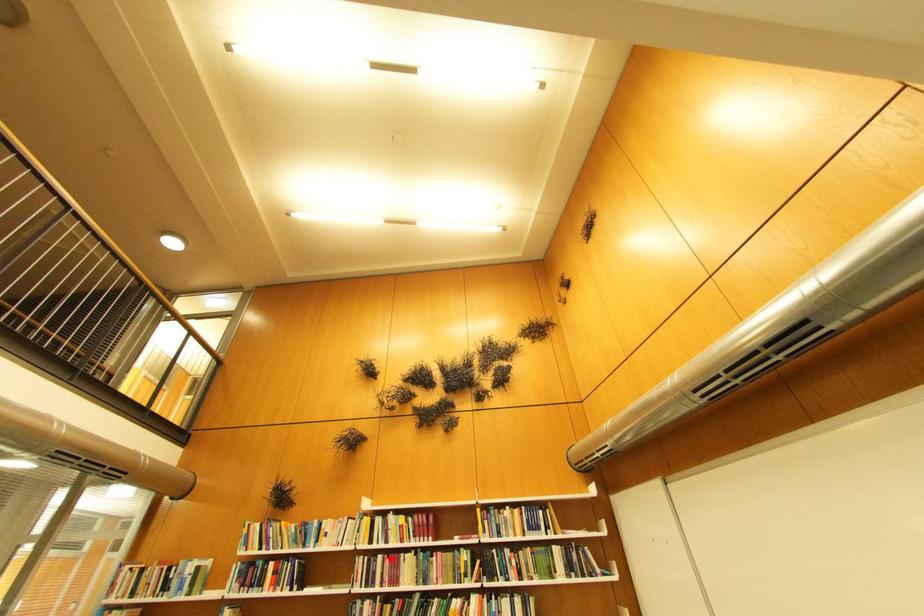
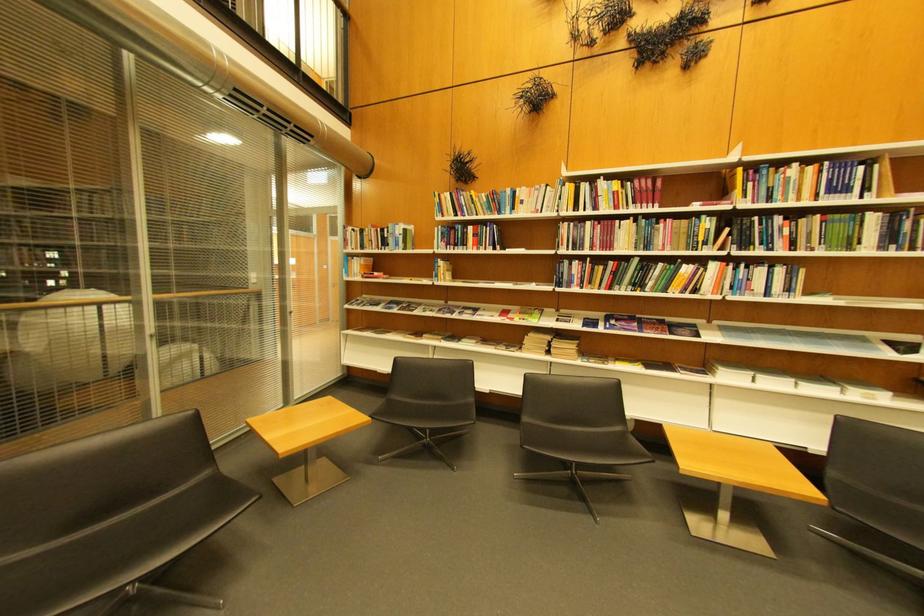
Question: I am providing you with two images of the same scene from different viewpoints. A red point is shown in image1. For the corresponding object point in image2, is it positioned nearer or farther from the camera?

Choices:
 (A) Nearer
 (B) Farther

Answer: (A)